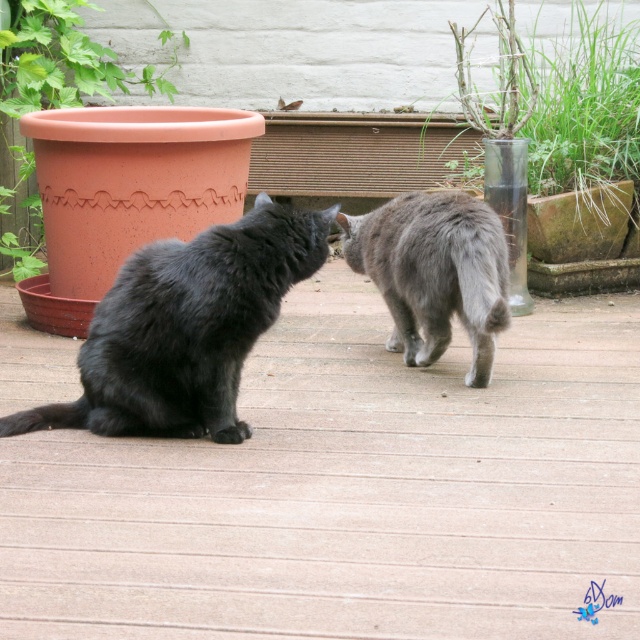
Can you confirm if smooth wooden deck at center is positioned below terracotta clay pot at left?

Yes, smooth wooden deck at center is below terracotta clay pot at left.

Which of these two, smooth wooden deck at center or terracotta clay pot at left, stands taller?

terracotta clay pot at left

Is point (420, 371) less distant than point (99, 76)?

Yes, it is.

The image size is (640, 640). What are the coordinates of `smooth wooden deck at center` in the screenshot? It's located at (349, 492).

Is shiny black cat at left thinner than transparent glass vase at upper center?

Incorrect, shiny black cat at left's width is not less than transparent glass vase at upper center's.

Between shiny black cat at left and transparent glass vase at upper center, which one is positioned higher?

transparent glass vase at upper center is higher up.

Does point (214, 419) lie in front of point (598, 102)?

Yes, it is.

This screenshot has height=640, width=640. I want to click on shiny black cat at left, so click(x=186, y=328).

Does shiny black cat at left have a greater height compared to terracotta clay pot at left?

Incorrect, shiny black cat at left's height is not larger of terracotta clay pot at left's.

The height and width of the screenshot is (640, 640). What are the coordinates of `shiny black cat at left` in the screenshot? It's located at (186, 328).